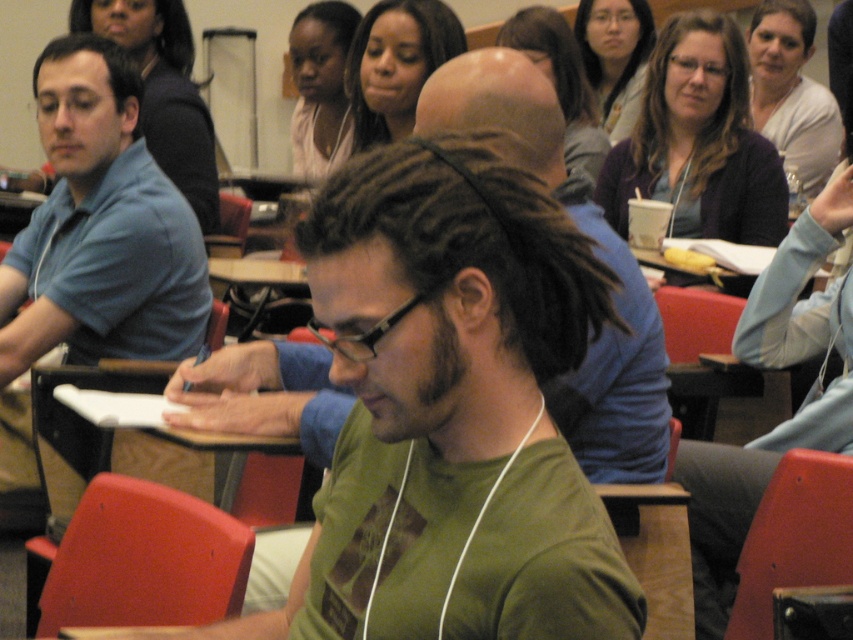
Where is `matte black shirt at center`? matte black shirt at center is located at coordinates (320, 86).

Looking at this image, who is shorter, matte black shirt at center or matte black hair at upper center?

matte black hair at upper center is shorter.

Identify the location of matte black shirt at center. This screenshot has width=853, height=640. (320, 86).

Which is more to the right, blue shirt at left or matte black shirt at center?

Positioned to the right is matte black shirt at center.

Does blue shirt at left appear on the left side of matte black shirt at center?

Correct, you'll find blue shirt at left to the left of matte black shirt at center.

You are a GUI agent. You are given a task and a screenshot of the screen. Output one action in this format:
    pyautogui.click(x=<x>, y=<y>)
    Task: Click on the blue shirt at left
    This screenshot has height=640, width=853.
    Given the screenshot: What is the action you would take?
    pyautogui.click(x=163, y=92)

You are a GUI agent. You are given a task and a screenshot of the screen. Output one action in this format:
    pyautogui.click(x=<x>, y=<y>)
    Task: Click on the blue shirt at left
    This screenshot has width=853, height=640.
    Given the screenshot: What is the action you would take?
    pyautogui.click(x=163, y=92)

Does blue cotton shirt at left have a smaller size compared to matte black hair at upper center?

Actually, blue cotton shirt at left might be larger than matte black hair at upper center.

Does blue cotton shirt at left appear under matte black hair at upper center?

Indeed, blue cotton shirt at left is positioned under matte black hair at upper center.

Is point (62, 324) positioned in front of point (622, 120)?

Yes, point (62, 324) is in front of point (622, 120).

Find the location of `blue cotton shirt at left`. blue cotton shirt at left is located at coordinates [x=100, y=227].